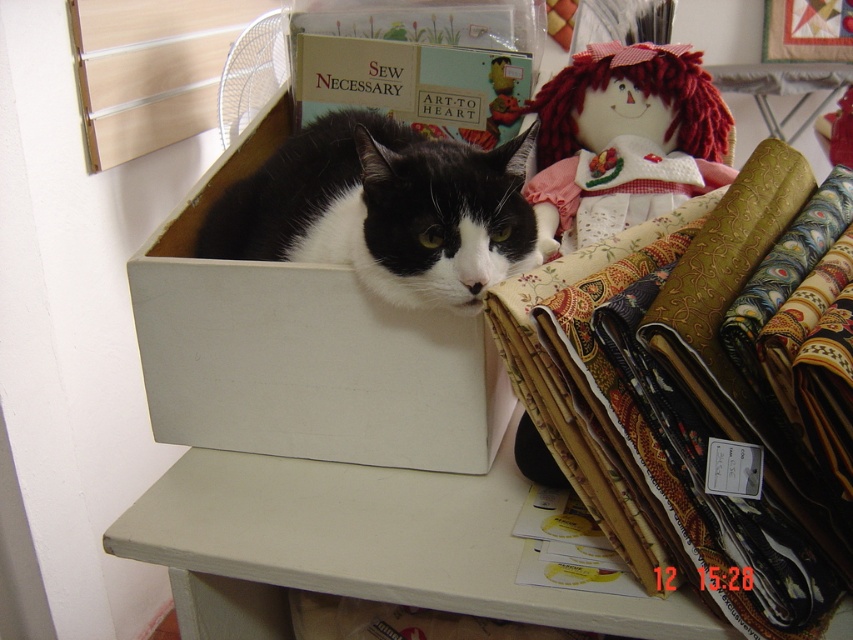
Question: Is white matte box at center bigger than matte cardboard box at center?

Choices:
 (A) yes
 (B) no

Answer: (A)

Question: Considering the relative positions of white matte box at center and black and white fur cat at center in the image provided, where is white matte box at center located with respect to black and white fur cat at center?

Choices:
 (A) left
 (B) right

Answer: (A)

Question: Which object is positioned closest to the black and white fur cat at center?

Choices:
 (A) white matte table at center
 (B) gold textured fabric at right

Answer: (B)

Question: From the image, what is the correct spatial relationship of black and white fur cat at center in relation to fluffy red yarn doll at upper right?

Choices:
 (A) left
 (B) right

Answer: (A)

Question: Among these points, which one is nearest to the camera?

Choices:
 (A) (634, 449)
 (B) (712, 93)
 (C) (444, 376)
 (D) (509, 152)

Answer: (A)

Question: Among these objects, which one is nearest to the camera?

Choices:
 (A) fluffy red yarn doll at upper right
 (B) white matte box at center
 (C) black and white fur cat at center
 (D) gold textured fabric at right

Answer: (D)